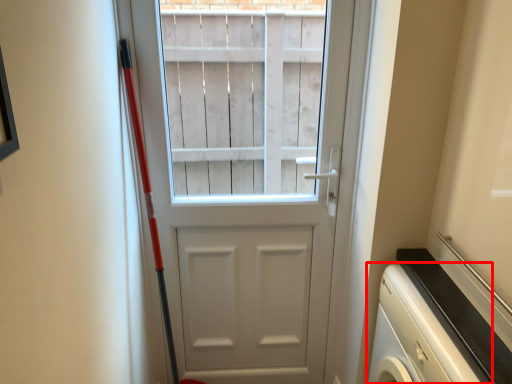
Question: In this image, where is dish washer (annotated by the red box) located relative to door?

Choices:
 (A) left
 (B) right

Answer: (B)